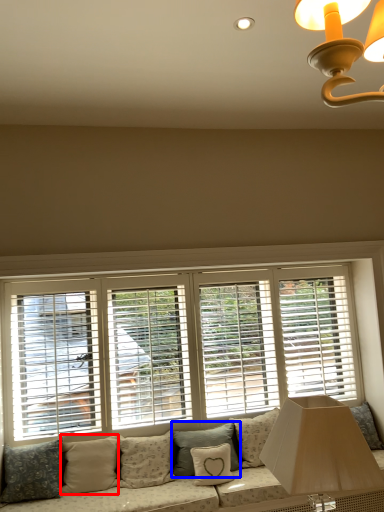
Question: Which object is closer to the camera taking this photo, pillow (highlighted by a red box) or pillow (highlighted by a blue box)?

Choices:
 (A) pillow
 (B) pillow

Answer: (A)